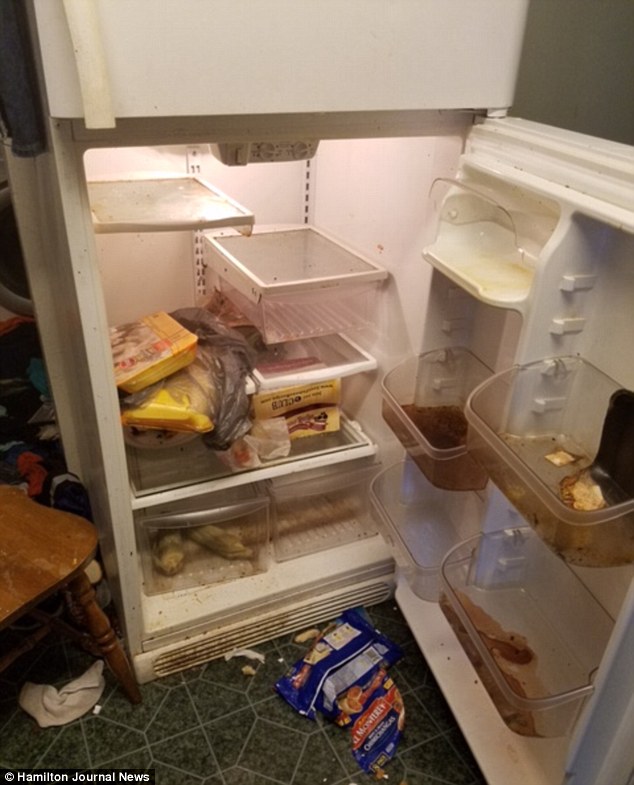
The width and height of the screenshot is (634, 785). Find the location of `fridge`. fridge is located at coordinates (x=96, y=363).